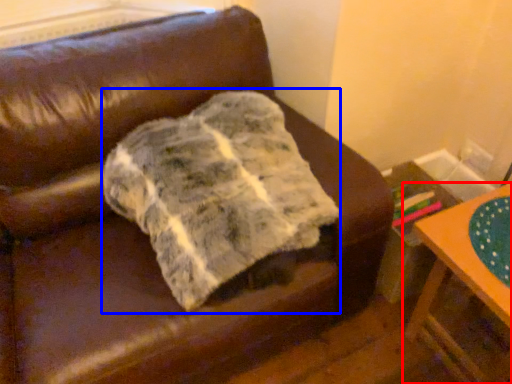
Question: Which of the following is the farthest to the observer, table (highlighted by a red box) or blanket (highlighted by a blue box)?

Choices:
 (A) table
 (B) blanket

Answer: (A)